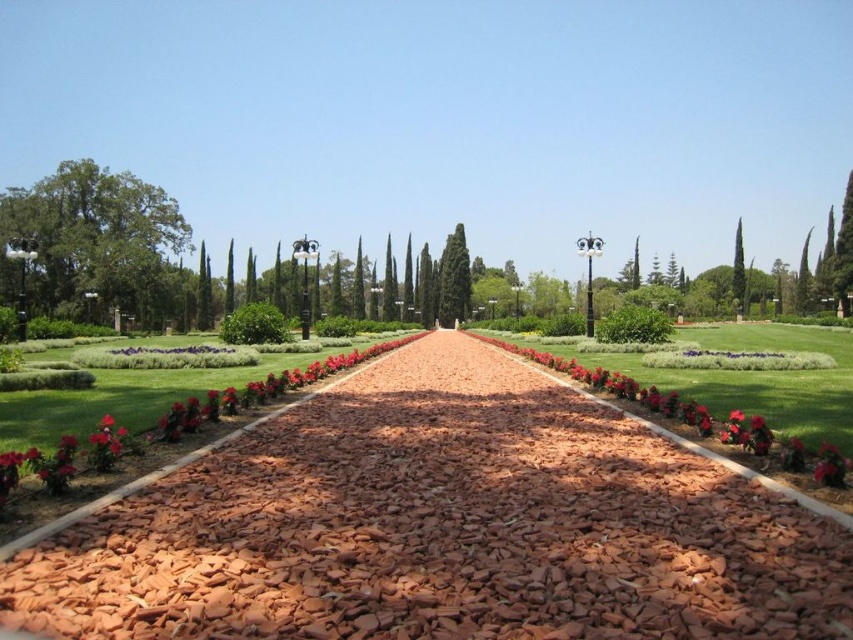
You are a landscape architect designing a garden layout. You need to place a new statue that requires a base 2 meters tall. Based on the image, which tree should you choose to place the statue next to, the green leafy tree at left or the green textured cypress at center?

The green textured cypress at center is taller than the green leafy tree at left, so placing the statue next to the green textured cypress at center would provide a suitable base height of 2 meters.

You are standing at the entrance of the garden and want to reach the monument at the end of the pathway. According to the image, where exactly is the red brick pathway at center located in terms of coordinates?

The red brick pathway at center is located at coordinates point (x=442, y=528).